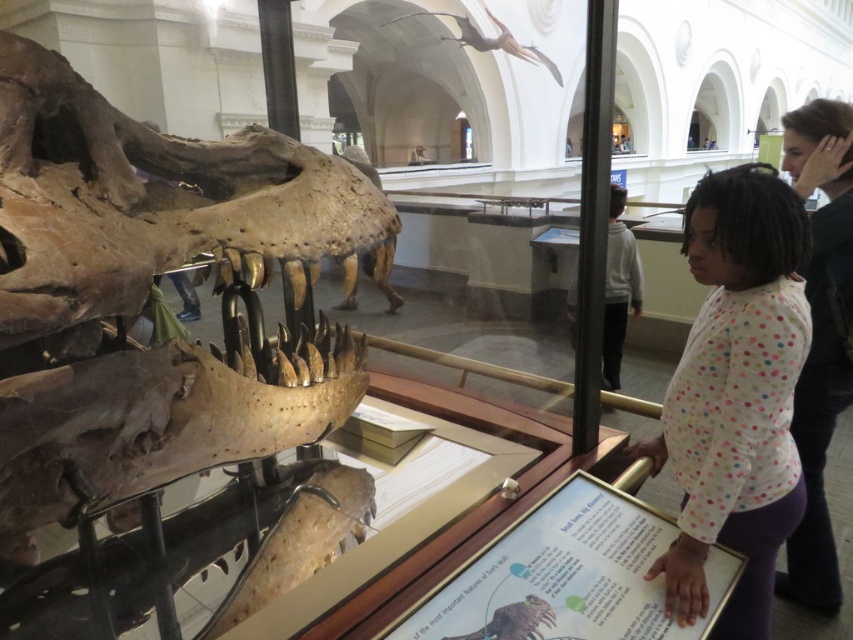
Can you confirm if brown rough skull at center is positioned to the right of white polka dot shirt at center?

In fact, brown rough skull at center is to the left of white polka dot shirt at center.

Is brown rough skull at center in front of white polka dot shirt at center?

Yes, it is in front of white polka dot shirt at center.

Is point (160, 163) farther from viewer compared to point (689, 385)?

No, (160, 163) is in front of (689, 385).

Where is `brown rough skull at center`? brown rough skull at center is located at coordinates (163, 356).

Looking at this image, who is shorter, brown rough skull at center or matte black hair at upper right?

With less height is brown rough skull at center.

Locate an element on the screen. brown rough skull at center is located at coordinates (163, 356).

Is point (770, 284) farther from camera compared to point (785, 129)?

No.

Is point (664, 449) farther from camera compared to point (831, 314)?

No.

The width and height of the screenshot is (853, 640). What are the coordinates of `white polka dot shirt at center` in the screenshot? It's located at (735, 394).